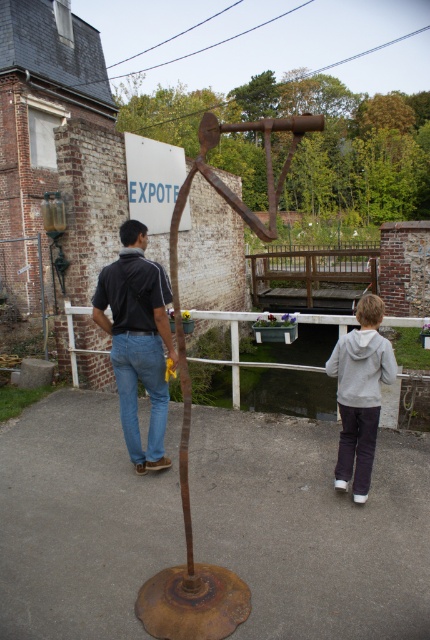
Question: Which object is closer to the camera taking this photo?

Choices:
 (A) gray fleece jacket at lower center
 (B) white wooden rail at center
 (C) denim jeans at center
 (D) blue denim jeans at center

Answer: (A)

Question: Among these objects, which one is nearest to the camera?

Choices:
 (A) blue denim jeans at center
 (B) brown wooden rail at center
 (C) gray fleece jacket at lower center
 (D) rusty metal sculpture at center

Answer: (D)

Question: Considering the real-world distances, which object is closest to the blue denim jeans at center?

Choices:
 (A) denim jeans at center
 (B) white wooden rail at center
 (C) brown wooden rail at center
 (D) gray fleece jacket at lower center

Answer: (A)

Question: Can you confirm if gray fleece jacket at lower center is thinner than brown wooden rail at center?

Choices:
 (A) yes
 (B) no

Answer: (A)

Question: Is rusty metal sculpture at center to the right of gray fleece jacket at lower center from the viewer's perspective?

Choices:
 (A) yes
 (B) no

Answer: (A)

Question: Is denim jeans at center bigger than white wooden rail at center?

Choices:
 (A) yes
 (B) no

Answer: (A)